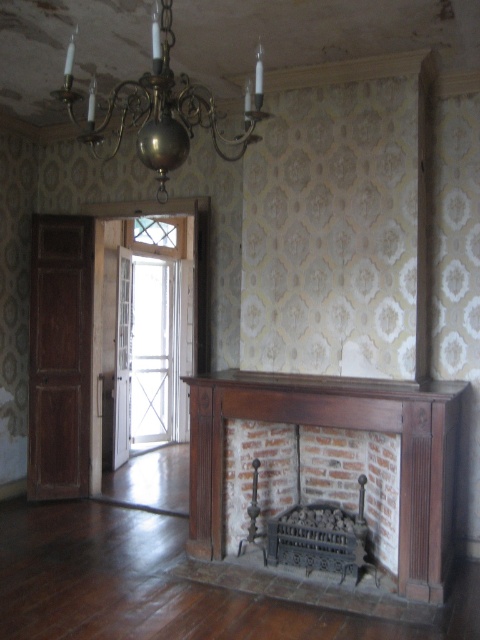
You are an interior designer assessing the space in front of the brown wooden fireplace at center and the brick fireplace at center. Which one has a larger size?

The brown wooden fireplace at center is bigger than the brick fireplace at center.

You are standing in the room and want to place a decorative item on the mantel shelf above the fireplace. Which fireplace should you consider for placing the item, the brown wooden fireplace at center or the brick fireplace at center?

You should consider the brown wooden fireplace at center because it is in front of the brick fireplace at center, meaning its mantel shelf is accessible for placing decorative items.